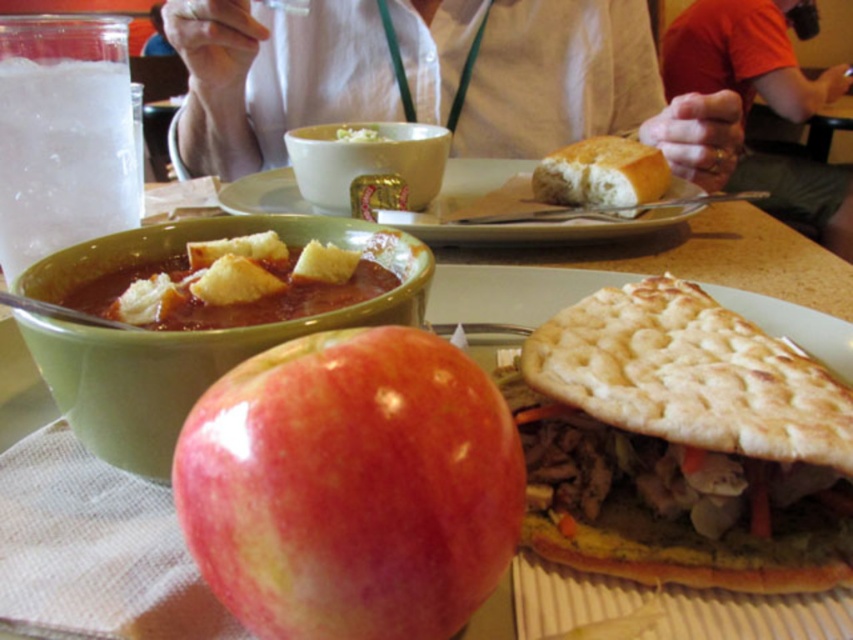
Question: Can you confirm if green matte bowl at center is positioned above golden crusty bread at upper center?

Choices:
 (A) no
 (B) yes

Answer: (A)

Question: Observing the image, what is the correct spatial positioning of orange cotton shirt at upper right in reference to matte white plate at center?

Choices:
 (A) below
 (B) above

Answer: (B)

Question: Is red matte apple at center below white matte bowl at upper center?

Choices:
 (A) no
 (B) yes

Answer: (B)

Question: Which is nearer to the matte ceramic bowl at center?

Choices:
 (A) white fabric shirt at upper center
 (B) white matte bowl at upper center
 (C) golden crusty bread at upper center
 (D) golden brown pita bread at center

Answer: (B)

Question: Which point appears farthest from the camera in this image?

Choices:
 (A) click(x=230, y=208)
 (B) click(x=337, y=509)
 (C) click(x=799, y=476)
 (D) click(x=524, y=61)

Answer: (D)

Question: Which of the following is the closest to the observer?

Choices:
 (A) (184, 106)
 (B) (332, 129)

Answer: (B)